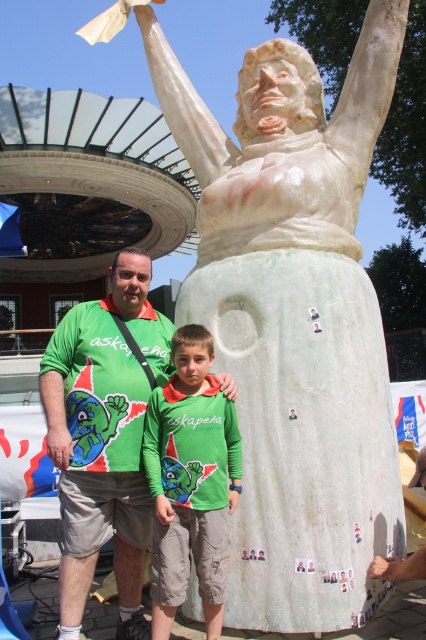
Does point (132, 496) lie behind point (172, 534)?

Yes, point (132, 496) is farther from viewer.

Does point (89, 563) come closer to viewer compared to point (207, 518)?

No, (89, 563) is further to viewer.

Which is behind, point (114, 410) or point (172, 481)?

The point (114, 410) is behind.

I want to click on green fabric shirt at center, so click(104, 435).